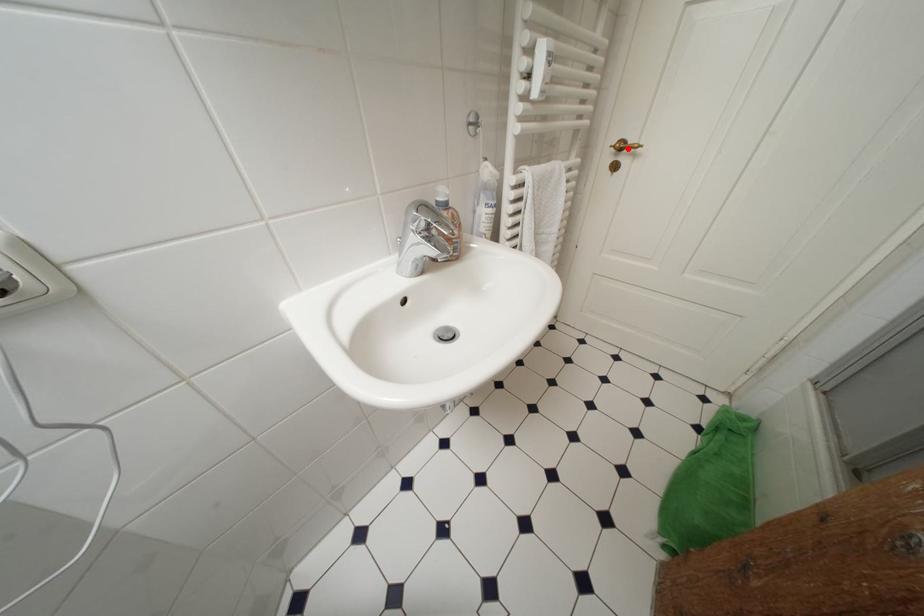
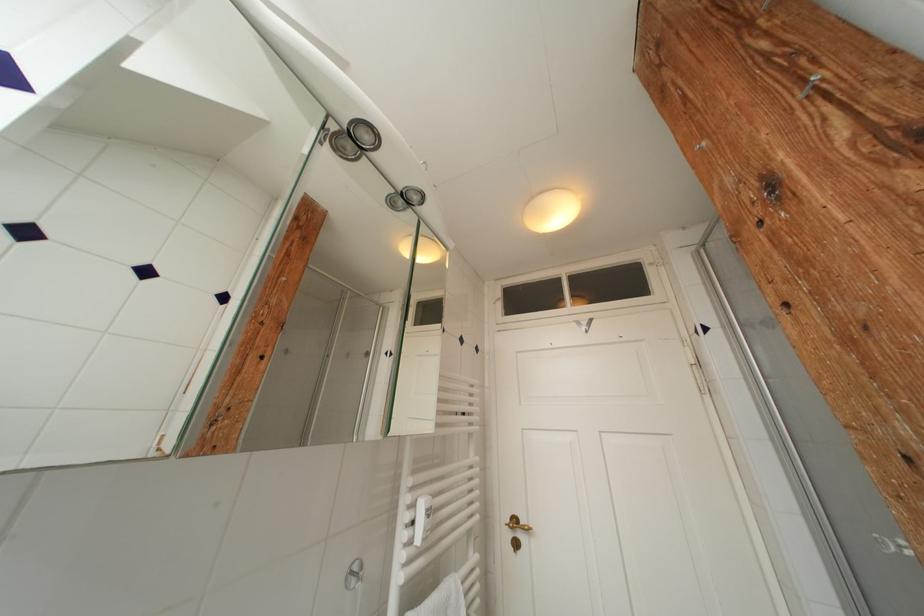
Locate, in the second image, the point that corresponds to the highlighted location in the first image.

(521, 525)